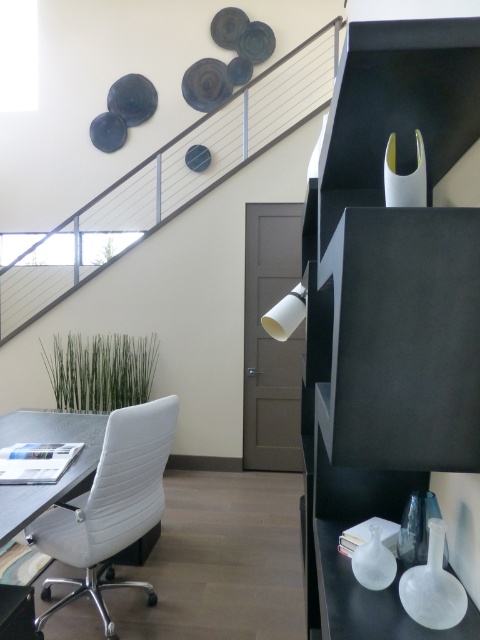
Question: From the image, what is the correct spatial relationship of metallic staircase at upper center in relation to white leather chair at lower left?

Choices:
 (A) right
 (B) left

Answer: (A)

Question: Which point is closer to the camera?

Choices:
 (A) white leather chair at lower left
 (B) metallic staircase at upper center

Answer: (A)

Question: Among these objects, which one is nearest to the camera?

Choices:
 (A) metallic staircase at upper center
 (B) white leather chair at lower left

Answer: (B)

Question: Which point is farther to the camera?

Choices:
 (A) (93, 540)
 (B) (178, 198)

Answer: (B)

Question: Can you confirm if metallic staircase at upper center is positioned below white leather chair at lower left?

Choices:
 (A) yes
 (B) no

Answer: (B)

Question: Does metallic staircase at upper center have a greater width compared to white leather chair at lower left?

Choices:
 (A) no
 (B) yes

Answer: (B)